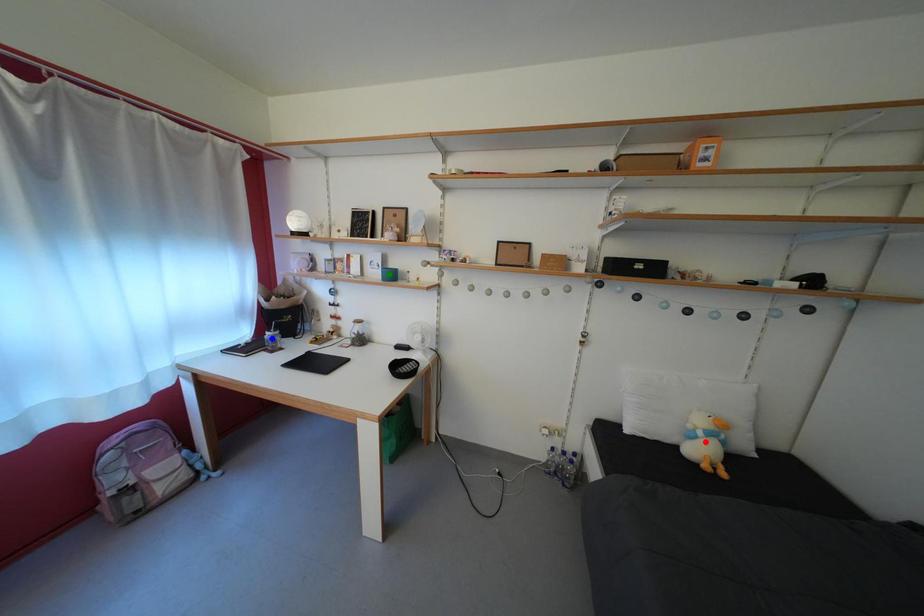
Order these from farthest to nearest:
red point | green point | blue point

blue point → green point → red point